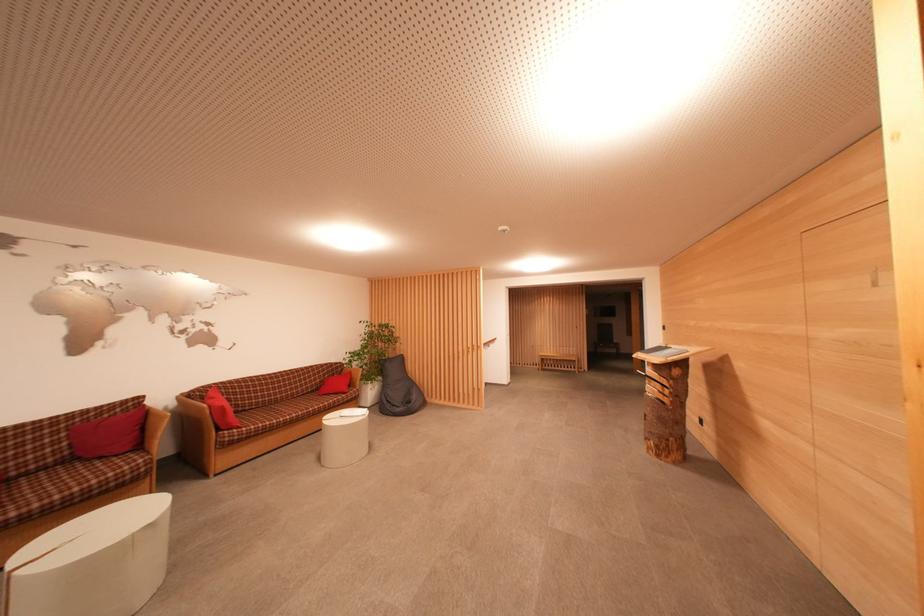
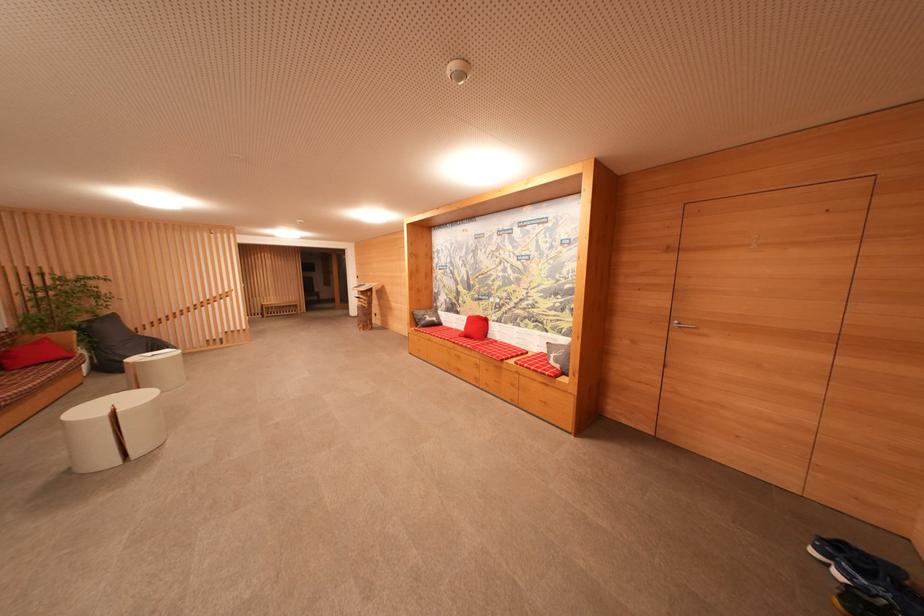
Where in the second image is the point corresponding to point (354, 376) from the first image?

(50, 342)